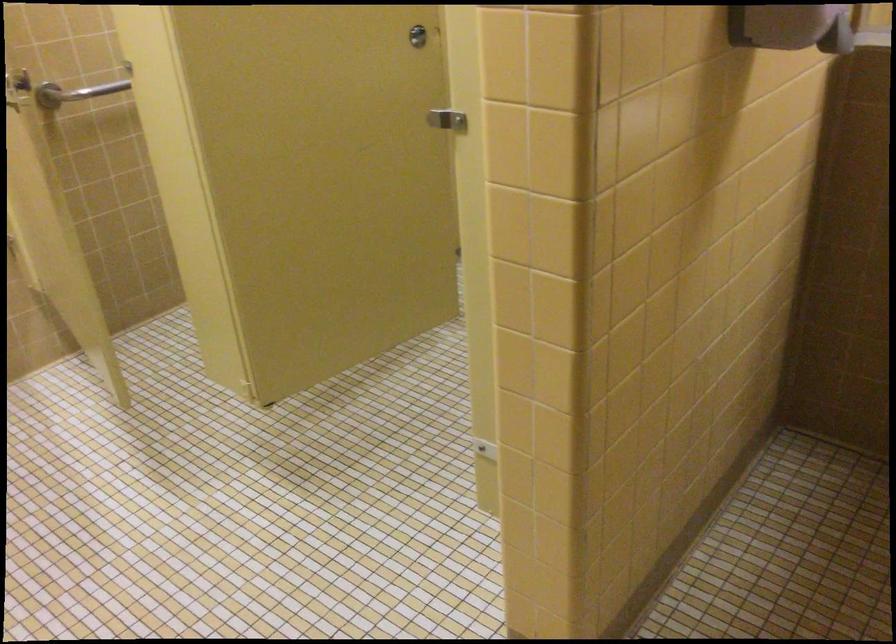
Describe the element at coordinates (75, 91) in the screenshot. The height and width of the screenshot is (644, 896). I see `the metal grab bar` at that location.